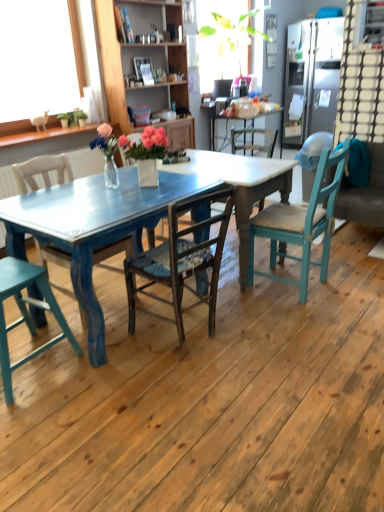
Question: Is teal fabric couch at right at the left side of wooden chair at center, which is counted as the 3th chair, starting from the left?

Choices:
 (A) yes
 (B) no

Answer: (B)

Question: From a real-world perspective, is teal fabric couch at right located beneath wooden chair at center, which is counted as the 3th chair, starting from the left?

Choices:
 (A) no
 (B) yes

Answer: (B)

Question: Is teal fabric couch at right oriented towards wooden chair at center, acting as the second chair starting from the right?

Choices:
 (A) yes
 (B) no

Answer: (A)

Question: From a real-world perspective, is teal fabric couch at right over wooden chair at center, which is counted as the 3th chair, starting from the left?

Choices:
 (A) no
 (B) yes

Answer: (A)

Question: Are teal fabric couch at right and wooden chair at center, which is counted as the 3th chair, starting from the left, far apart?

Choices:
 (A) yes
 (B) no

Answer: (A)

Question: From a real-world perspective, is wooden chair at center, which is counted as the 3th chair, starting from the left, above or below wooden chair at center, positioned as the second chair in left-to-right order?

Choices:
 (A) below
 (B) above

Answer: (B)

Question: Is wooden chair at center, acting as the second chair starting from the right, taller or shorter than wooden chair at center, acting as the 3th chair starting from the right?

Choices:
 (A) short
 (B) tall

Answer: (A)

Question: Choose the correct answer: Is wooden chair at center, which is counted as the 3th chair, starting from the left, inside wooden chair at center, positioned as the second chair in left-to-right order, or outside it?

Choices:
 (A) outside
 (B) inside

Answer: (A)

Question: Is wooden chair at center, acting as the second chair starting from the right, bigger or smaller than wooden chair at center, acting as the 3th chair starting from the right?

Choices:
 (A) big
 (B) small

Answer: (B)

Question: Based on their sizes in the image, would you say wooden cabinet at upper center is bigger or smaller than teal painted wood chair at lower left, arranged as the 4th chair when viewed from the right?

Choices:
 (A) small
 (B) big

Answer: (B)

Question: From the image's perspective, is wooden cabinet at upper center located above or below teal painted wood chair at lower left, placed as the 1th chair when sorted from left to right?

Choices:
 (A) below
 (B) above

Answer: (B)

Question: Is wooden cabinet at upper center wider or thinner than teal painted wood chair at lower left, placed as the 1th chair when sorted from left to right?

Choices:
 (A) wide
 (B) thin

Answer: (B)

Question: Is point (188, 138) positioned closer to the camera than point (69, 340)?

Choices:
 (A) closer
 (B) farther

Answer: (B)

Question: In the image, is wooden chair at center, acting as the second chair starting from the right, positioned in front of or behind teal fabric couch at right?

Choices:
 (A) behind
 (B) front

Answer: (B)

Question: From the image's perspective, is wooden chair at center, which is counted as the 3th chair, starting from the left, positioned above or below teal fabric couch at right?

Choices:
 (A) above
 (B) below

Answer: (B)